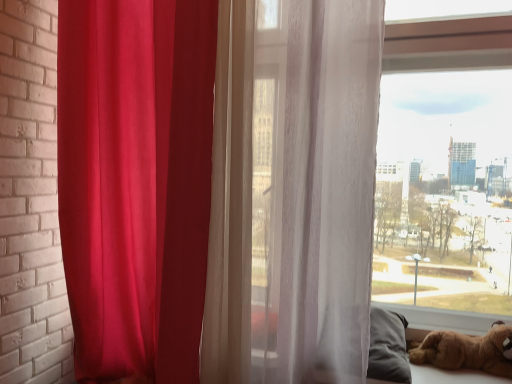
Question: Is brown plush toy at lower right closer to camera compared to matte red curtain at left, the first curtain viewed from the left?

Choices:
 (A) yes
 (B) no

Answer: (B)

Question: Is brown plush toy at lower right smaller than matte red curtain at left, the first curtain viewed from the left?

Choices:
 (A) yes
 (B) no

Answer: (A)

Question: Can you confirm if brown plush toy at lower right is shorter than matte red curtain at left, the first curtain viewed from the left?

Choices:
 (A) yes
 (B) no

Answer: (A)

Question: Is brown plush toy at lower right far away from matte red curtain at left, which is the second curtain from right to left?

Choices:
 (A) no
 (B) yes

Answer: (B)

Question: From the image's perspective, does brown plush toy at lower right appear higher than matte red curtain at left, which is the second curtain from right to left?

Choices:
 (A) no
 (B) yes

Answer: (A)

Question: Is brown plush toy at lower right wider or thinner than translucent white curtain at center, the 1th curtain from the right?

Choices:
 (A) wide
 (B) thin

Answer: (B)

Question: Does point click(x=445, y=347) appear closer or farther from the camera than point click(x=344, y=312)?

Choices:
 (A) farther
 (B) closer

Answer: (A)

Question: Is brown plush toy at lower right inside or outside of translucent white curtain at center, which is counted as the second curtain, starting from the left?

Choices:
 (A) outside
 (B) inside

Answer: (A)

Question: Considering their positions, is brown plush toy at lower right located in front of or behind translucent white curtain at center, the 1th curtain from the right?

Choices:
 (A) front
 (B) behind

Answer: (B)

Question: From a real-world perspective, relative to brown plush toy at lower right, is translucent white curtain at center, the 1th curtain from the right, vertically above or below?

Choices:
 (A) above
 (B) below

Answer: (A)

Question: Is translucent white curtain at center, the 1th curtain from the right, in front of or behind brown plush toy at lower right in the image?

Choices:
 (A) front
 (B) behind

Answer: (A)

Question: Is translucent white curtain at center, which is counted as the second curtain, starting from the left, wider or thinner than brown plush toy at lower right?

Choices:
 (A) wide
 (B) thin

Answer: (A)

Question: Do you think translucent white curtain at center, which is counted as the second curtain, starting from the left, is within brown plush toy at lower right, or outside of it?

Choices:
 (A) outside
 (B) inside

Answer: (A)

Question: Would you say matte red curtain at left, the first curtain viewed from the left, is inside or outside brown plush toy at lower right?

Choices:
 (A) outside
 (B) inside

Answer: (A)

Question: Considering their positions, is matte red curtain at left, which is the second curtain from right to left, located in front of or behind brown plush toy at lower right?

Choices:
 (A) front
 (B) behind

Answer: (A)